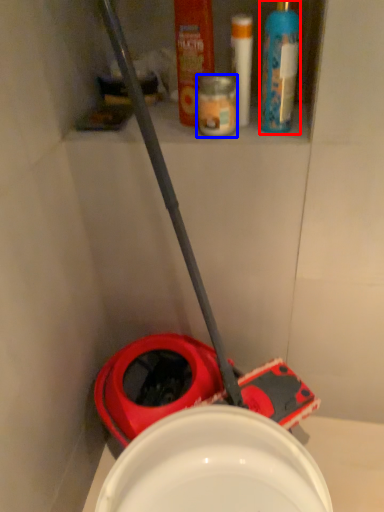
Question: Among these objects, which one is nearest to the camera, cleaning product (highlighted by a red box) or toiletry (highlighted by a blue box)?

Choices:
 (A) cleaning product
 (B) toiletry

Answer: (A)